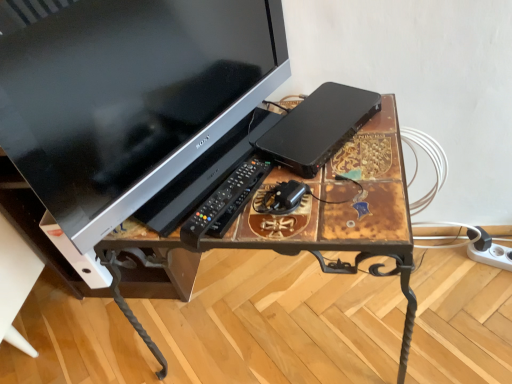
Question: Is black plastic power adapter at center closer to the viewer compared to rustic wood desk at center?

Choices:
 (A) yes
 (B) no

Answer: (B)

Question: Is black plastic power adapter at center positioned behind rustic wood desk at center?

Choices:
 (A) yes
 (B) no

Answer: (A)

Question: Is black plastic power adapter at center to the left of rustic wood desk at center from the viewer's perspective?

Choices:
 (A) no
 (B) yes

Answer: (A)

Question: From a real-world perspective, does black plastic power adapter at center sit lower than rustic wood desk at center?

Choices:
 (A) no
 (B) yes

Answer: (A)

Question: Is black plastic power adapter at center outside rustic wood desk at center?

Choices:
 (A) no
 (B) yes

Answer: (B)

Question: Can you confirm if black plastic power adapter at center is shorter than rustic wood desk at center?

Choices:
 (A) no
 (B) yes

Answer: (B)

Question: From the image's perspective, is black plastic remote at center located beneath black plastic computer at center?

Choices:
 (A) no
 (B) yes

Answer: (B)

Question: Can you confirm if black plastic remote at center is taller than black plastic computer at center?

Choices:
 (A) yes
 (B) no

Answer: (B)

Question: Does black plastic remote at center have a greater width compared to black plastic computer at center?

Choices:
 (A) yes
 (B) no

Answer: (B)

Question: Can you confirm if black plastic remote at center is smaller than black plastic computer at center?

Choices:
 (A) yes
 (B) no

Answer: (A)

Question: Is black plastic remote at center at the right side of black plastic computer at center?

Choices:
 (A) no
 (B) yes

Answer: (A)

Question: Considering the relative positions of black plastic remote at center and black plastic computer at center in the image provided, is black plastic remote at center to the left of black plastic computer at center from the viewer's perspective?

Choices:
 (A) no
 (B) yes

Answer: (B)

Question: Is black plastic power adapter at center bigger than white plastic extension cord at lower right?

Choices:
 (A) yes
 (B) no

Answer: (B)